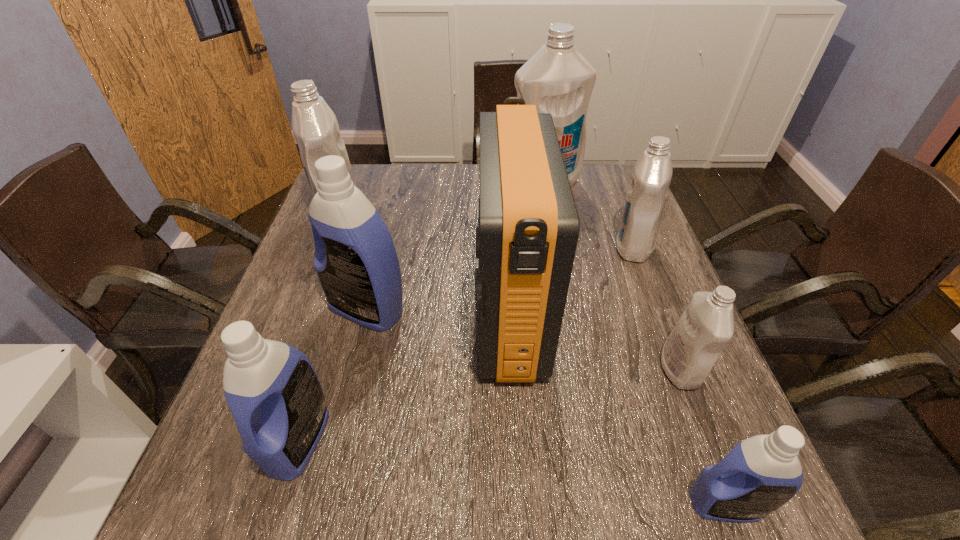
Find the location of `vacant space in between the third nearest detergent and the farthest white detergent`. vacant space in between the third nearest detergent and the farthest white detergent is located at coordinates (612, 276).

I want to click on free point between the third smallest white detergent and the farthest detergent, so click(x=443, y=200).

Where is `vacant space that is in between the nearest white detergent and the second smallest white detergent`? This screenshot has width=960, height=540. vacant space that is in between the nearest white detergent and the second smallest white detergent is located at coordinates (657, 308).

Locate an element on the screen. The image size is (960, 540). vacant area that lies between the second white detergent from left to right and the second smallest blue detergent is located at coordinates (420, 312).

Find the location of a particular element. vacant point located between the second smallest blue detergent and the rightmost blue detergent is located at coordinates (512, 471).

The width and height of the screenshot is (960, 540). What are the coordinates of `free space between the second smallest blue detergent and the smallest white detergent` in the screenshot? It's located at 490,404.

Where is `free point between the smallest white detergent and the second biggest blue detergent`? The height and width of the screenshot is (540, 960). free point between the smallest white detergent and the second biggest blue detergent is located at coordinates (490, 404).

The width and height of the screenshot is (960, 540). What are the coordinates of `blank region between the radio receiver and the second smallest blue detergent` in the screenshot? It's located at (403, 377).

Choose which object is the fifth nearest neighbor to the second biggest white detergent. Please provide its 2D coordinates. Your answer should be formatted as a tuple, i.e. [(x, y)], where the tuple contains the x and y coordinates of a point satisfying the conditions above.

[(647, 194)]

The height and width of the screenshot is (540, 960). Identify the location of object that stands as the second closest to the fourth farthest detergent. (274, 394).